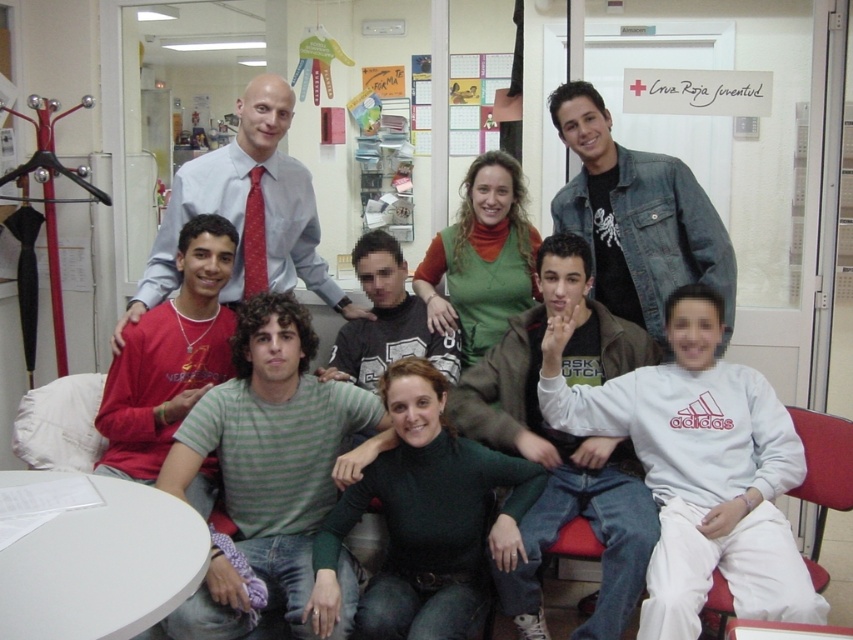
Question: Which of the following is the farthest from the observer?

Choices:
 (A) light blue shirt at center
 (B) denim jacket at upper center
 (C) green matte turtleneck at center

Answer: (A)

Question: Which object appears farthest from the camera in this image?

Choices:
 (A) green striped shirt at center
 (B) green matte turtleneck at center
 (C) dark brown leather jacket at center
 (D) light blue shirt at center

Answer: (D)

Question: Is green striped shirt at center wider than dark brown leather jacket at center?

Choices:
 (A) no
 (B) yes

Answer: (A)

Question: Observing the image, what is the correct spatial positioning of green matte turtleneck at center in reference to denim jacket at upper center?

Choices:
 (A) right
 (B) left

Answer: (B)

Question: Is green striped shirt at center wider than denim jacket at upper center?

Choices:
 (A) yes
 (B) no

Answer: (A)

Question: Which of the following is the farthest from the observer?

Choices:
 (A) denim jacket at upper center
 (B) light blue shirt at center
 (C) green striped shirt at center

Answer: (B)